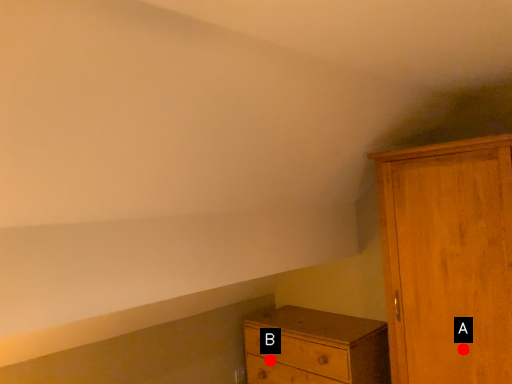
Question: Two points are circled on the image, labeled by A and B beside each circle. Which point appears closest to the camera in this image?

Choices:
 (A) A is closer
 (B) B is closer

Answer: (A)